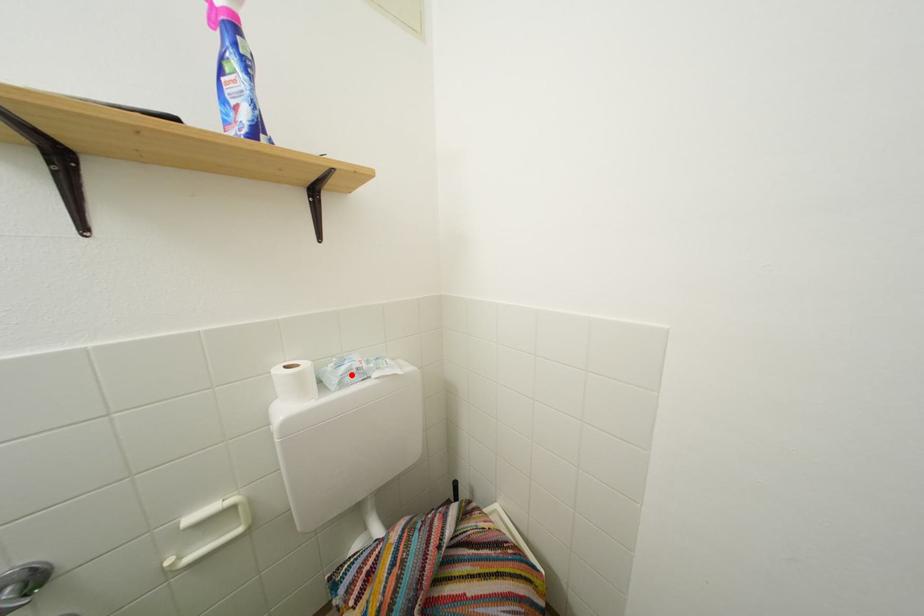
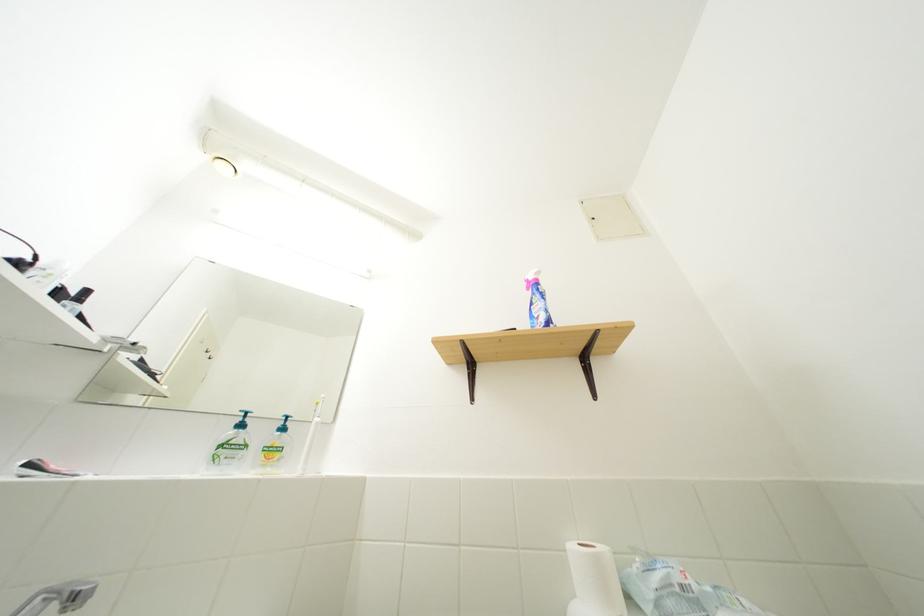
The point at the highlighted location is marked in the first image. Where is the corresponding point in the second image?

(665, 585)